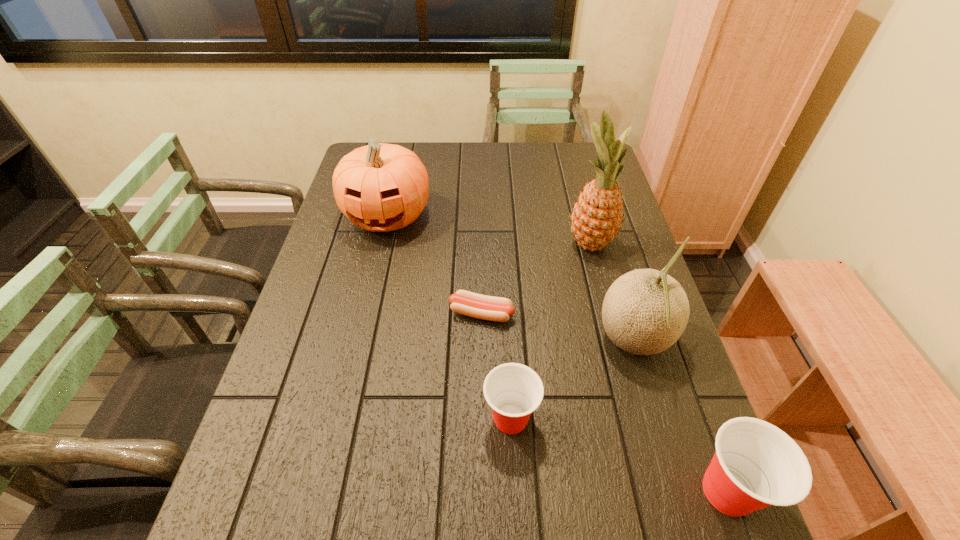
The cups are evenly distributed in the image. To maintain this, where would you place another cup on the left? Please point to a free space. Please provide its 2D coordinates. Your answer should be formatted as a tuple, i.e. [(x, y)], where the tuple contains the x and y coordinates of a point satisfying the conditions above.

[(336, 360)]